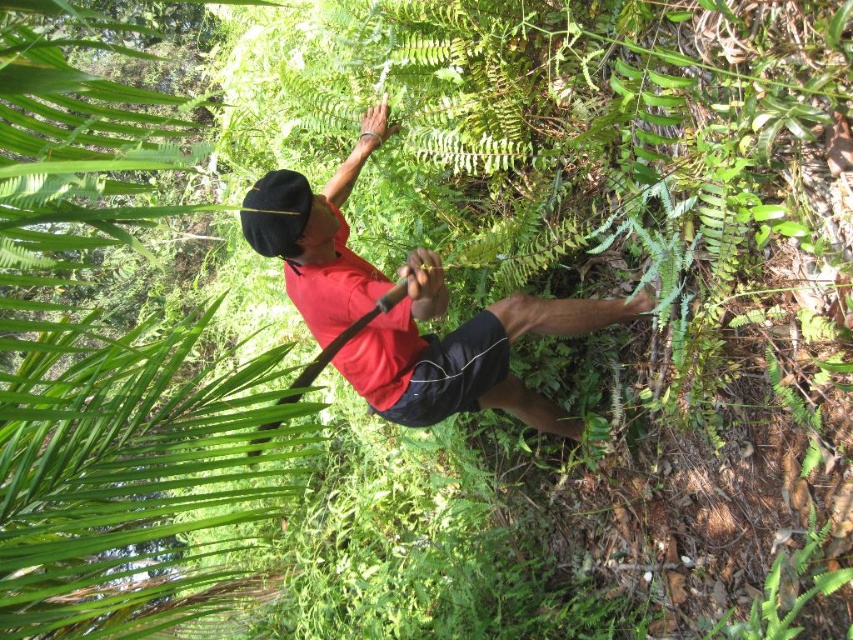
Looking at this image, you are a hiker trying to take a photo of the green leafy tree at upper left without blocking it with the red matte shirt at center. Is there a way to position yourself so the tree is visible behind the shirt?

The green leafy tree at upper left is positioned under the red matte shirt at center, so if you move to the side or adjust your angle so the shirt is not directly in front of the tree, you can capture the tree behind the shirt without obstruction.

You are a hiker trying to take a photo of the red matte shirt at center. To avoid the green leafy tree at upper left blocking the shot, should you crouch down or stand on a rock to get a better angle?

The green leafy tree at upper left is taller than the red matte shirt at center, so to avoid the tree blocking the shot, you should crouch down to lower your viewpoint and ensure the tree stays above the frame while keeping the red matte shirt at center visible.